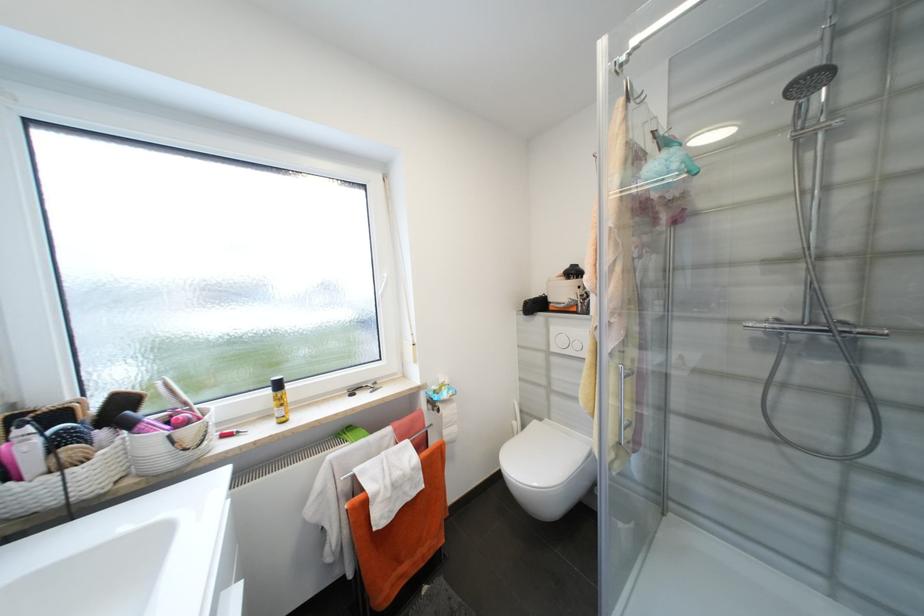
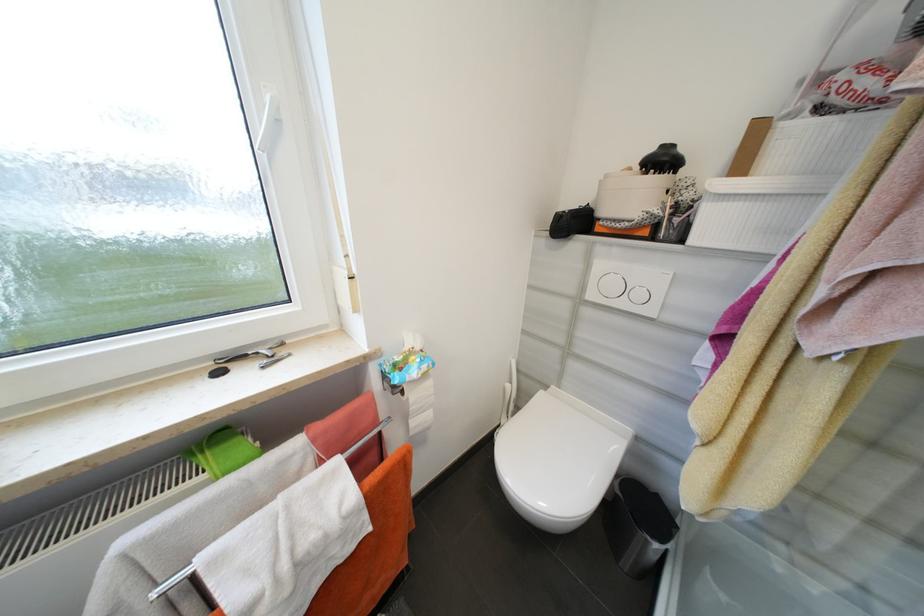
Where in the second image is the point corresponding to (531,304) from the first image?

(565, 217)